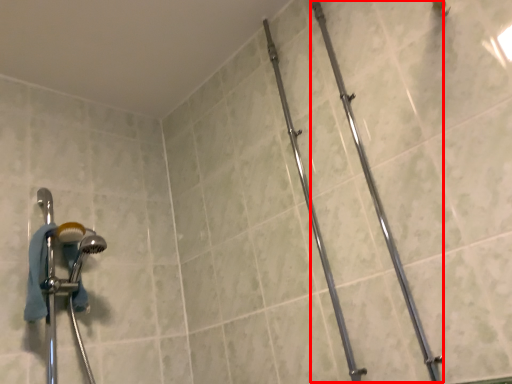
Question: From the image's perspective, considering the relative positions of pipe (annotated by the red box) and pipe in the image provided, where is pipe (annotated by the red box) located with respect to the staircase?

Choices:
 (A) above
 (B) below

Answer: (A)